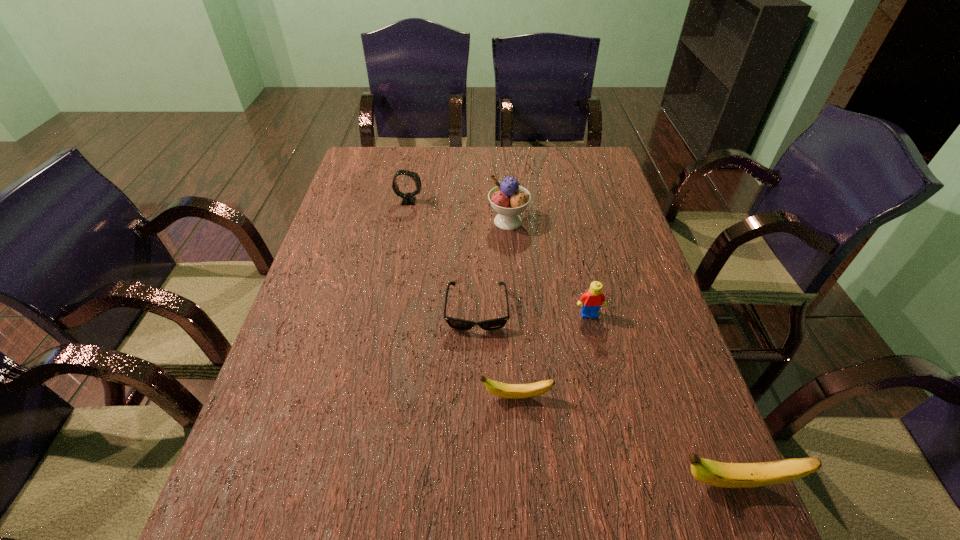
Locate an element on the screen. This screenshot has width=960, height=540. vacant point located between the nearest object and the fifth farthest object is located at coordinates point(625,440).

At what (x,y) coordinates should I click in order to perform the action: click on unoccupied area between the shortest object and the fifth tallest object. Please return your answer as a coordinate pair (x, y). The width and height of the screenshot is (960, 540). Looking at the image, I should click on (496, 354).

This screenshot has height=540, width=960. What are the coordinates of `unoccupied area between the icecream and the second nearest object` in the screenshot? It's located at (512, 309).

This screenshot has height=540, width=960. I want to click on vacant area that lies between the second nearest object and the sunglasses, so click(496, 354).

Image resolution: width=960 pixels, height=540 pixels. In order to click on vacant space that is in between the leftmost object and the sunglasses in this screenshot , I will do `click(443, 256)`.

Where is `vacant area that lies between the farthest object and the shortest object`? The height and width of the screenshot is (540, 960). vacant area that lies between the farthest object and the shortest object is located at coordinates (443, 256).

The width and height of the screenshot is (960, 540). Find the location of `free area in between the sunglasses and the nearer banana`. free area in between the sunglasses and the nearer banana is located at coordinates (605, 396).

I want to click on vacant area that lies between the tallest object and the shortest object, so click(492, 266).

What are the coordinates of `empty space that is in between the leftmost object and the right banana` in the screenshot? It's located at (571, 342).

This screenshot has height=540, width=960. What are the coordinates of `empty space that is in between the sunglasses and the icecream` in the screenshot? It's located at (492, 266).